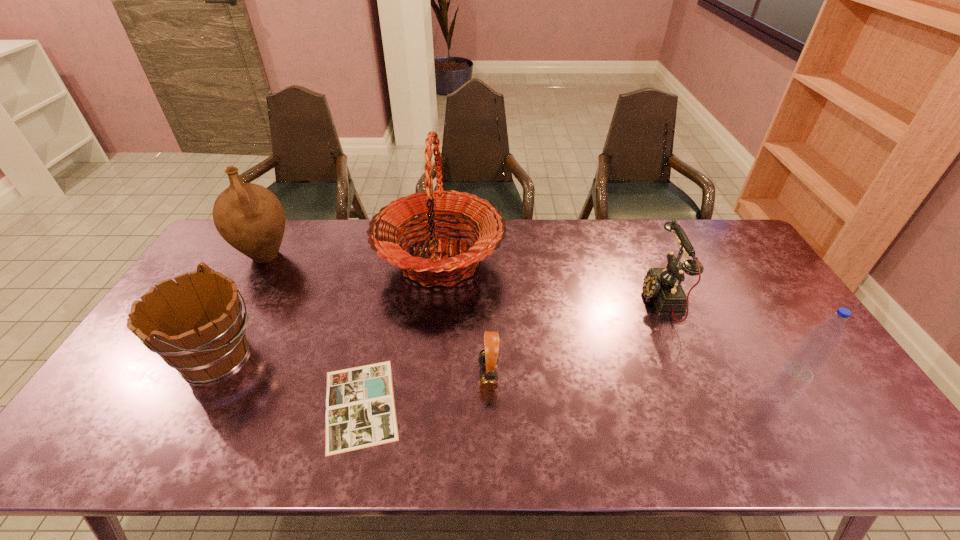
Find the location of a particular element. basket is located at coordinates (436, 206).

This screenshot has height=540, width=960. I want to click on pitcher, so click(x=249, y=217).

Locate an element on the screen. wine bucket is located at coordinates (195, 325).

I want to click on telephone, so click(x=663, y=285).

Where is `water bottle`? This screenshot has width=960, height=540. water bottle is located at coordinates (811, 355).

Find the location of a particular element. the sixth tallest object is located at coordinates (488, 358).

Identify the location of the shortest object. (360, 409).

You are a GUI agent. You are given a task and a screenshot of the screen. Output one action in this format:
    pyautogui.click(x=<x>, y=<y>)
    Task: Click on the vacant space located 0.260m on the left of the basket
    The width and height of the screenshot is (960, 540).
    Given the screenshot: What is the action you would take?
    pyautogui.click(x=299, y=261)

Locate an element on the screen. The width and height of the screenshot is (960, 540). free spot located 0.190m on the right of the second tallest object is located at coordinates (350, 255).

Locate an element on the screen. The width and height of the screenshot is (960, 540). vacant area located with the handle on the wine bucket is located at coordinates (282, 357).